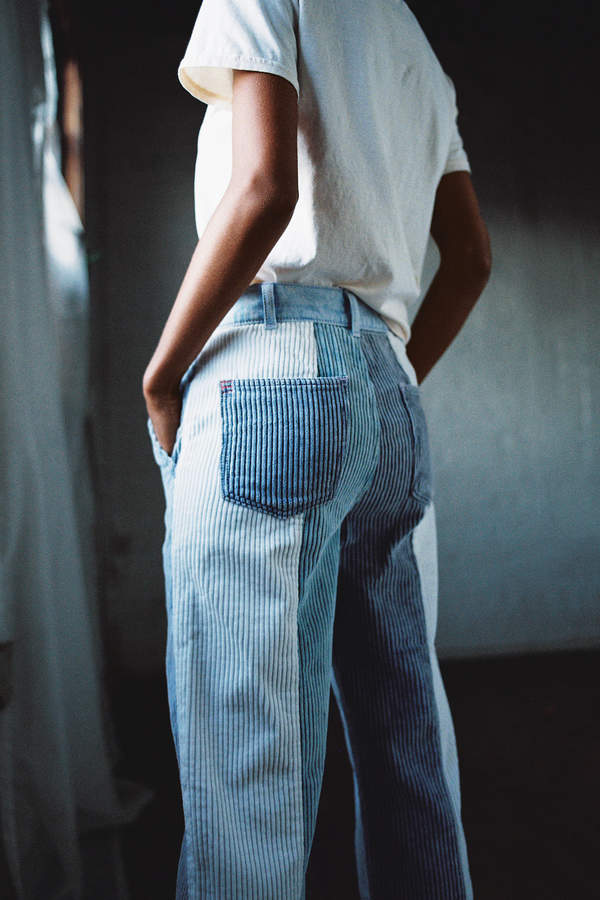
Identify the location of wall. (524, 608).